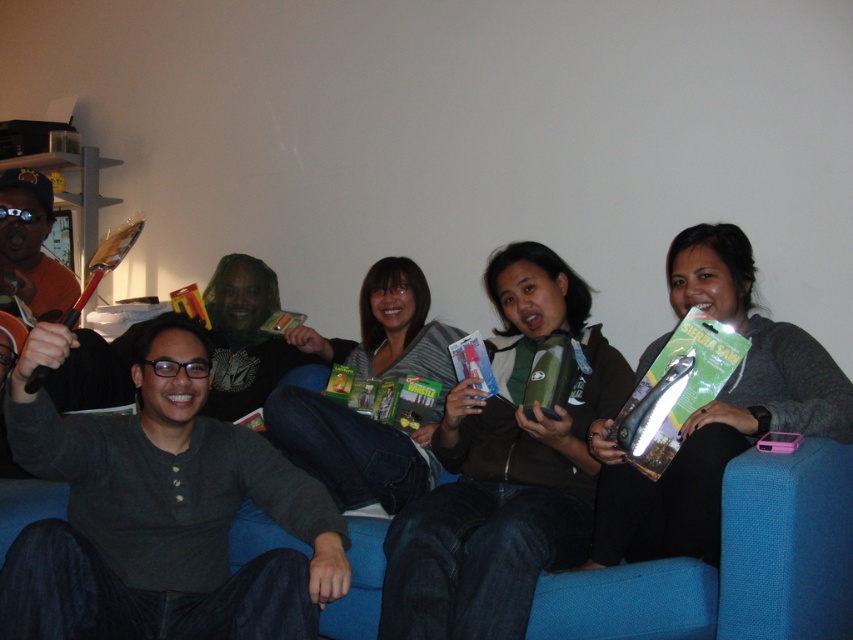
You are a photographer standing at the origin point of the coordinate system. You want to take a photo of the green matte water bottle at center. What are the coordinates where you should aim your camera?

The coordinates to aim the camera are at point (503, 468) to capture the green matte water bottle at center.

You are organizing a camping gear display. You have two items to place on a shelf. The items are the green matte water bottle at center and the matte green box at center. According to the image, which item should be placed to the right of the other?

The green matte water bottle at center should be placed to the right of the matte green box at center because in the image, the green matte water bottle at center is to the right of the matte green box at center.

You are organizing a camping gear display and need to place the matte gray sweater at center and the clear plastic survival saw at center on a shelf. According to the image, which item should be placed to the left to match the original arrangement?

The clear plastic survival saw at center should be placed to the left of the matte gray sweater at center to maintain the original arrangement as shown in the image.